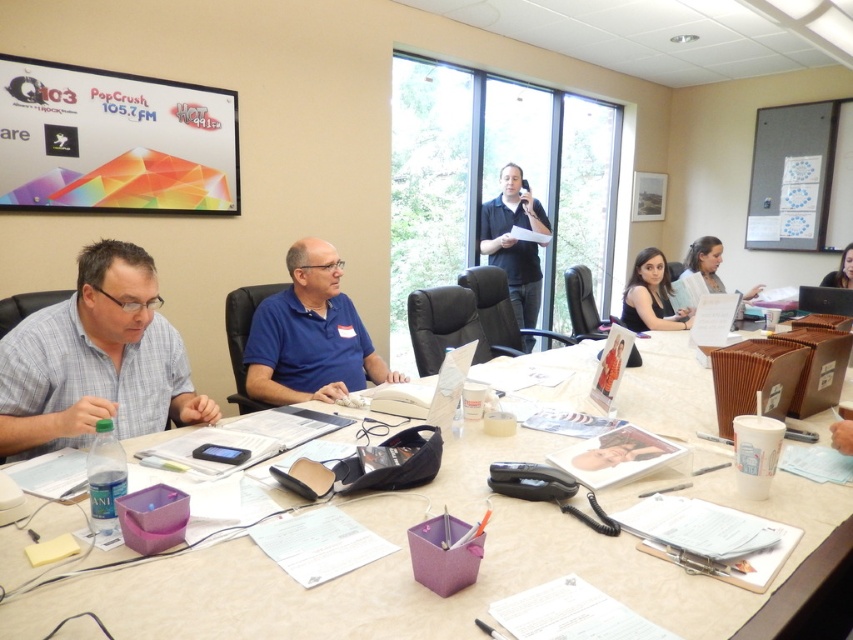
Is black matte shirt at center bigger than smooth skin face at upper right?

Correct, black matte shirt at center is larger in size than smooth skin face at upper right.

This screenshot has height=640, width=853. I want to click on black matte shirt at center, so click(x=514, y=241).

Between point (509, 221) and point (851, 284), which one is positioned in front?

Point (851, 284)

Locate an element on the screen. Image resolution: width=853 pixels, height=640 pixels. black matte shirt at center is located at coordinates (514, 241).

Between black fabric shirt at center and smooth skin face at upper right, which one has less height?

With less height is smooth skin face at upper right.

Is black fabric shirt at center positioned before smooth skin face at upper right?

Yes, black fabric shirt at center is in front of smooth skin face at upper right.

Is point (654, 259) less distant than point (851, 288)?

That is True.

Where is `black fabric shirt at center`? The width and height of the screenshot is (853, 640). black fabric shirt at center is located at coordinates (650, 296).

Can you confirm if gray checkered shirt at left is positioned above black fabric shirt at center?

No.

In order to click on gray checkered shirt at left in this screenshot , I will do `click(96, 360)`.